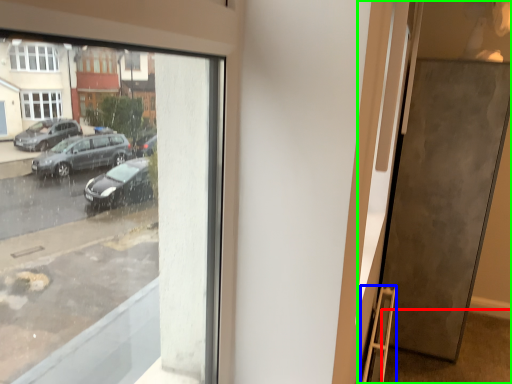
Question: Estimate the real-world distances between objects in this image. Which object is closer to pavement (highlighted by a red box), ladder (highlighted by a blue box) or door (highlighted by a green box)?

Choices:
 (A) ladder
 (B) door

Answer: (B)